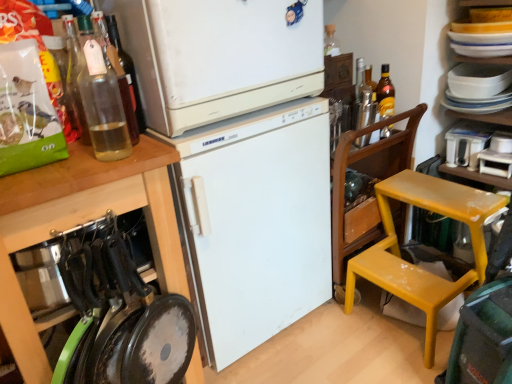
Where is `vacant area that is situated to the right of clear glass bottle at upper left, which appears as the 1th bottle when viewed from the left`? vacant area that is situated to the right of clear glass bottle at upper left, which appears as the 1th bottle when viewed from the left is located at coordinates (147, 154).